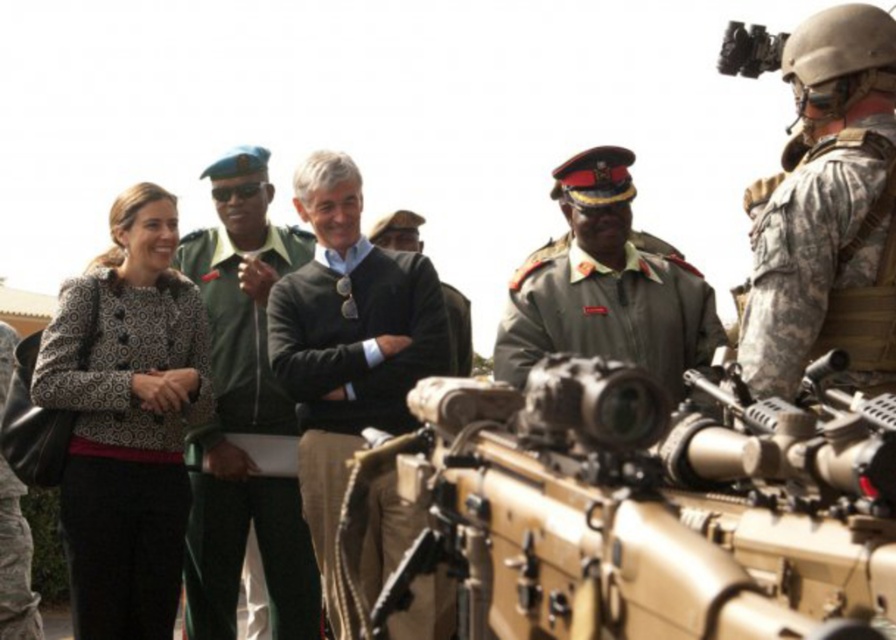
You are observing a military vehicle and notice two people nearby. One is wearing a patterned fabric coat at center, and the other is in a green military uniform at center. Which of these two individuals is standing to the left of the other?

The patterned fabric coat at center is positioned on the left side of the green military uniform at center, so the individual in the patterned fabric coat at center is standing to the left of the one in the green military uniform at center.

You are a photographer trying to capture a clear shot of the tan matte rifle at center and the dark gray sweater at center. Since you want to focus on both objects equally, which one should you adjust your camera settings to prioritize due to their size difference?

The tan matte rifle at center is wider than the dark gray sweater at center, so you should prioritize focusing on the tan matte rifle at center to ensure both are in frame and properly captured.

You are a photographer at the scene and want to capture a photo that includes both the dark gray sweater at center and the green uniform at center. Based on their positions, which one should you focus on first to ensure both are in the frame?

The dark gray sweater at center is positioned on the right side of green uniform at center, so you should focus on the green uniform at center first to ensure both are in the frame.